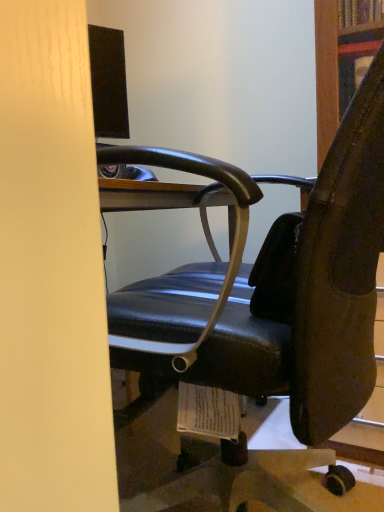
Describe the element at coordinates (257, 323) in the screenshot. I see `black leather chair at center` at that location.

Locate an element on the screen. The width and height of the screenshot is (384, 512). black leather chair at center is located at coordinates (257, 323).

In the scene shown: Measure the distance between point (220, 311) and camera.

The depth of point (220, 311) is 20.55 inches.

Locate an element on the screen. This screenshot has height=512, width=384. black leather chair at center is located at coordinates (257, 323).